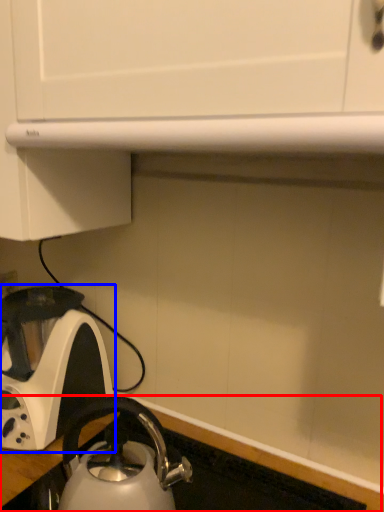
Question: Which point is closer to the camera, counter top (highlighted by a red box) or kettle (highlighted by a blue box)?

Choices:
 (A) counter top
 (B) kettle

Answer: (A)